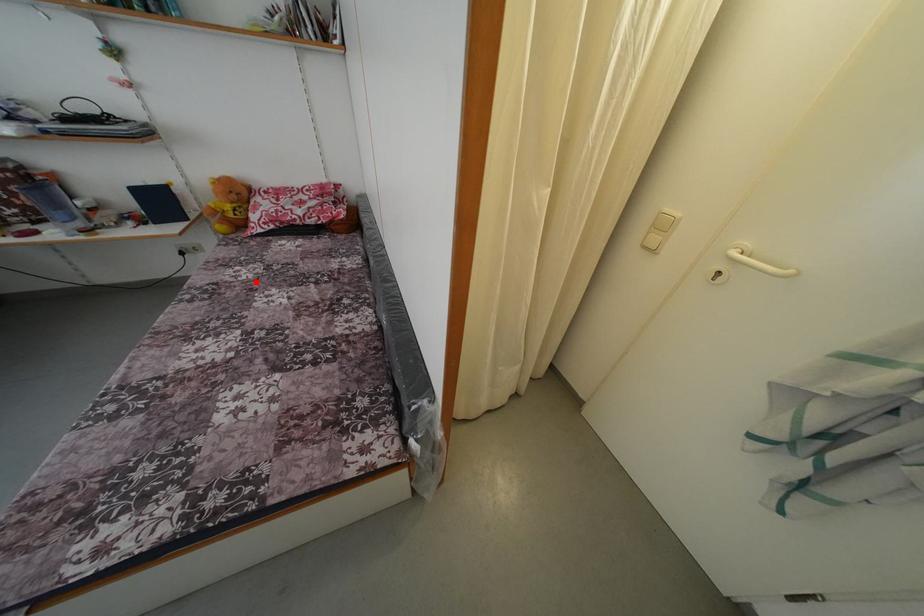
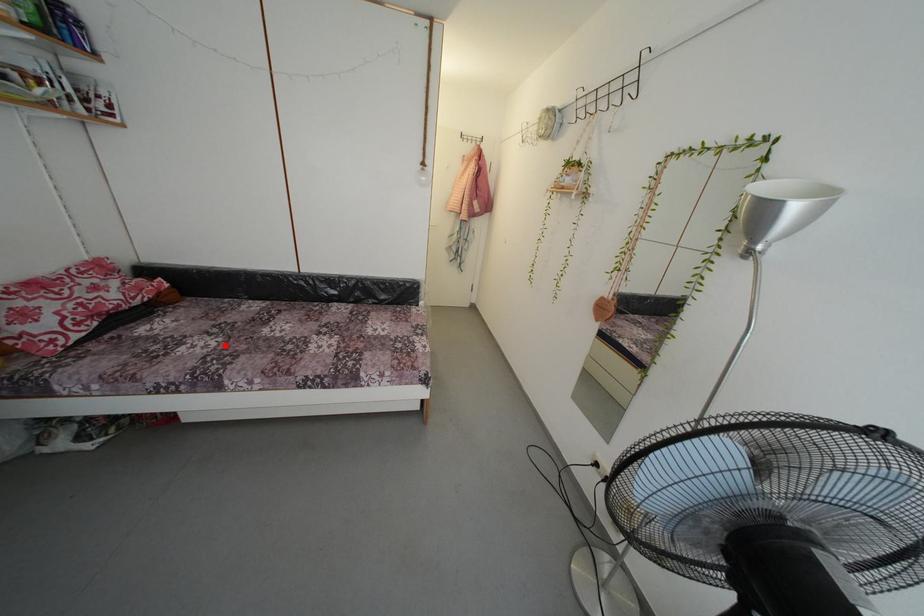
I am providing you with two images of the same scene from different viewpoints. A red point is marked on the first image and another point is marked on the second image. Is the marked point in image1 the same physical position as the marked point in image2?

Yes